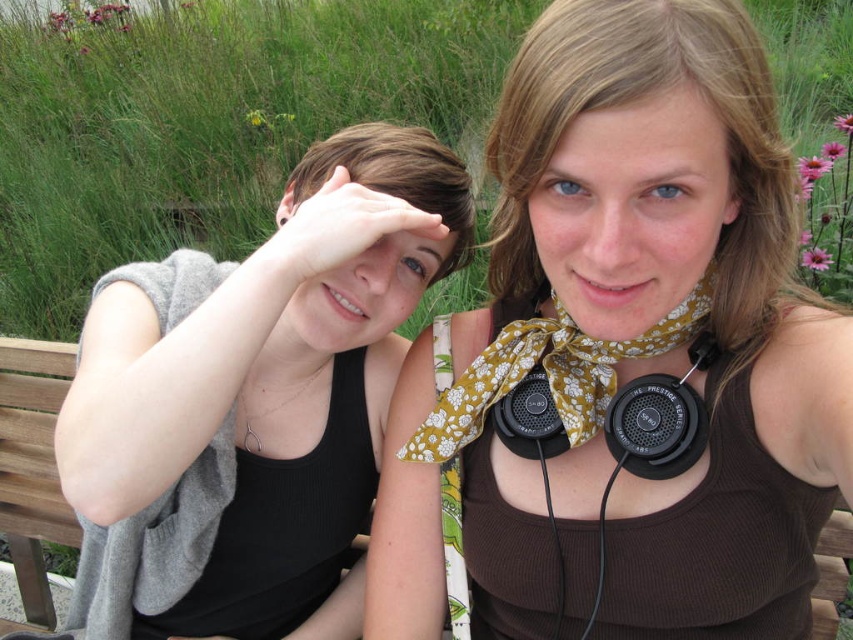
Is brown ribbed tank top at center positioned in front of black matte earphone at upper center?

Yes, brown ribbed tank top at center is closer to the viewer.

Can you confirm if brown ribbed tank top at center is taller than black matte earphone at upper center?

Indeed, brown ribbed tank top at center has a greater height compared to black matte earphone at upper center.

Where is `brown ribbed tank top at center`? brown ribbed tank top at center is located at coordinates 625,356.

Where is `brown ribbed tank top at center`? brown ribbed tank top at center is located at coordinates (625, 356).

Where is `brown ribbed tank top at center`? The image size is (853, 640). brown ribbed tank top at center is located at coordinates (625, 356).

Locate an element on the screen. The height and width of the screenshot is (640, 853). brown ribbed tank top at center is located at coordinates (625, 356).

Locate an element on the screen. The width and height of the screenshot is (853, 640). smooth brown hair at center is located at coordinates (398, 177).

The image size is (853, 640). Identify the location of smooth brown hair at center. (398, 177).